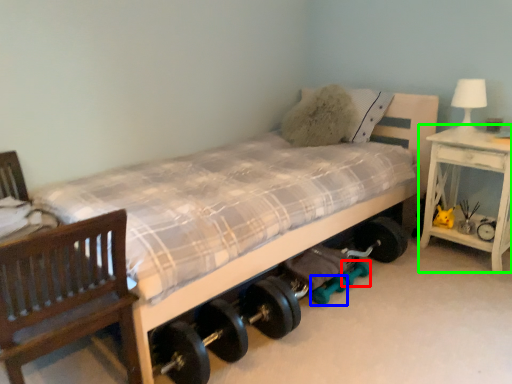
Question: Based on their relative distances, which object is nearer to dumbbell (highlighted by a red box)? Choose from dumbbell (highlighted by a blue box) and nightstand (highlighted by a green box).

Choices:
 (A) dumbbell
 (B) nightstand

Answer: (A)